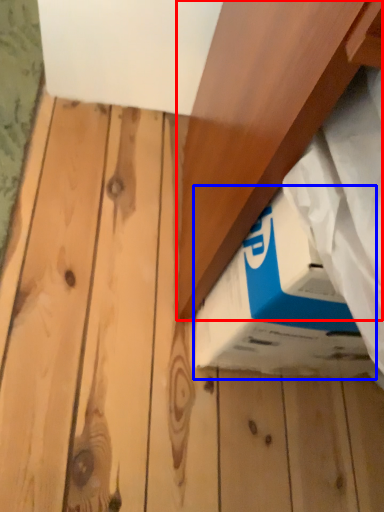
Question: Which object is closer to the camera taking this photo, plank (highlighted by a red box) or box (highlighted by a blue box)?

Choices:
 (A) plank
 (B) box

Answer: (A)